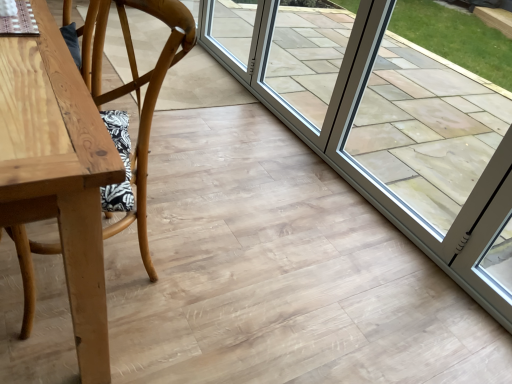
Locate an element on the screen. vacant space underneath clear glass door at center (from a real-world perspective) is located at coordinates (278, 109).